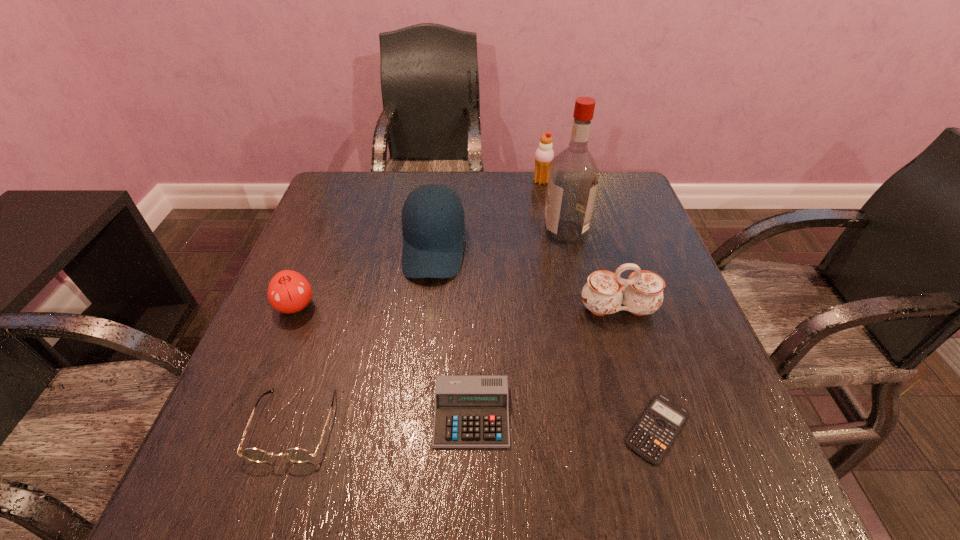
Image resolution: width=960 pixels, height=540 pixels. Identify the location of blank space located on the back of the shorter calculator. (608, 266).

Find the location of a particular element. The image size is (960, 540). liquor at the far edge is located at coordinates (573, 179).

Identify the location of icecream that is at the far edge. The height and width of the screenshot is (540, 960). (544, 154).

The height and width of the screenshot is (540, 960). Find the location of `baseball cap present at the far edge`. baseball cap present at the far edge is located at coordinates (433, 224).

At what (x,y) coordinates should I click in order to perform the action: click on spectacles located in the near edge section of the desktop. Please return your answer as a coordinate pair (x, y). The width and height of the screenshot is (960, 540). Looking at the image, I should click on (298, 455).

Where is `apple present at the left edge`? apple present at the left edge is located at coordinates (288, 292).

The height and width of the screenshot is (540, 960). I want to click on spectacles that is at the left edge, so click(x=298, y=455).

The image size is (960, 540). What are the coordinates of `chinaware situated at the right edge` in the screenshot? It's located at (641, 294).

Locate an element on the screen. This screenshot has width=960, height=540. calculator positioned at the right edge is located at coordinates (652, 436).

Locate an element on the screen. object at the near left corner is located at coordinates (298, 455).